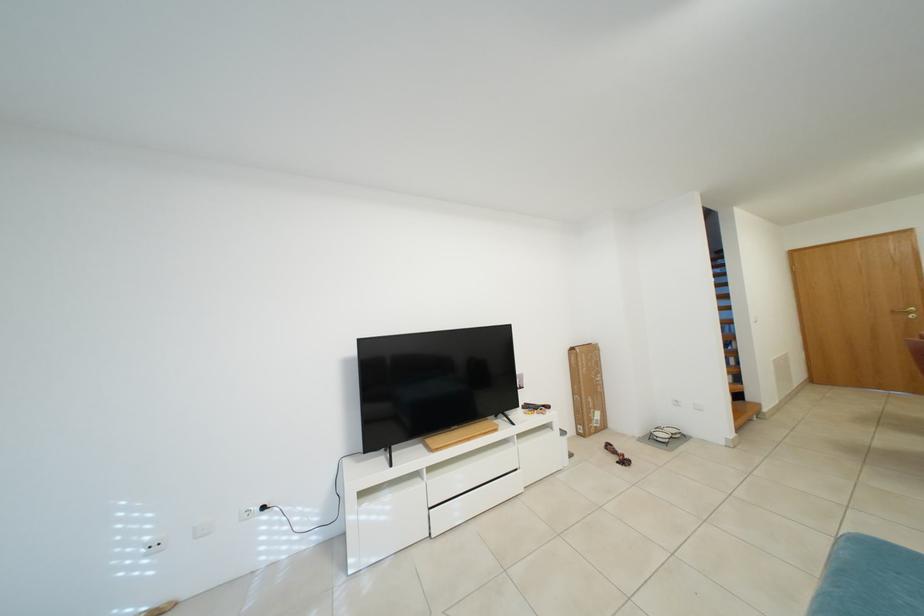
Locate an element on the screen. Image resolution: width=924 pixels, height=616 pixels. gold door handle is located at coordinates (909, 315).